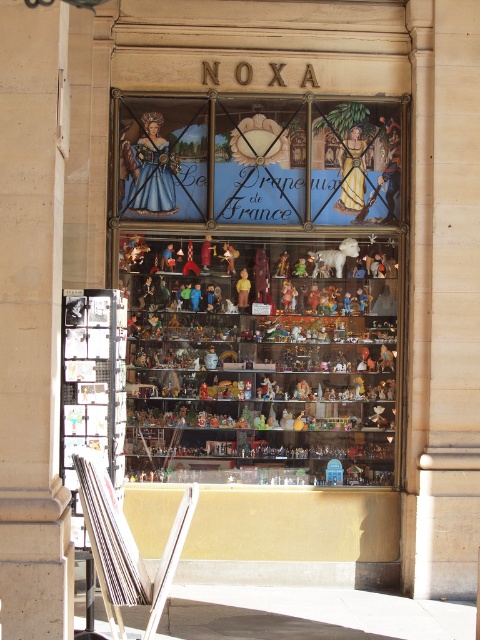
Is multicolored figurines at center shorter than matte yellow figurine at center?

No, multicolored figurines at center is not shorter than matte yellow figurine at center.

Which is more to the left, multicolored figurines at center or matte yellow figurine at center?

matte yellow figurine at center

Between point (151, 284) and point (241, 291), which one is positioned in front?

Point (241, 291) is more forward.

Find the location of a particular element. This screenshot has height=640, width=480. multicolored figurines at center is located at coordinates (261, 289).

Which is below, white plush bear at center or matte yellow figurine at center?

matte yellow figurine at center is below.

Who is more forward, (311, 252) or (240, 305)?

Point (311, 252) is in front.

The height and width of the screenshot is (640, 480). I want to click on white plush bear at center, so (337, 253).

Between multicolored figurines at center and white plush bear at center, which one is positioned higher?

white plush bear at center is above.

Does point (351, 406) come in front of point (342, 250)?

No, it is behind (342, 250).

Where is `multicolored figurines at center`? multicolored figurines at center is located at coordinates (261, 289).